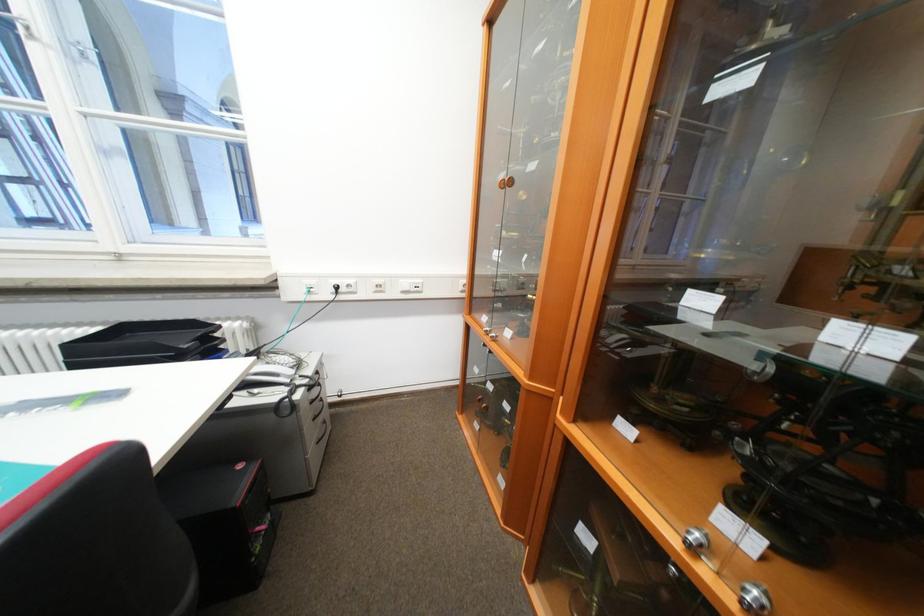
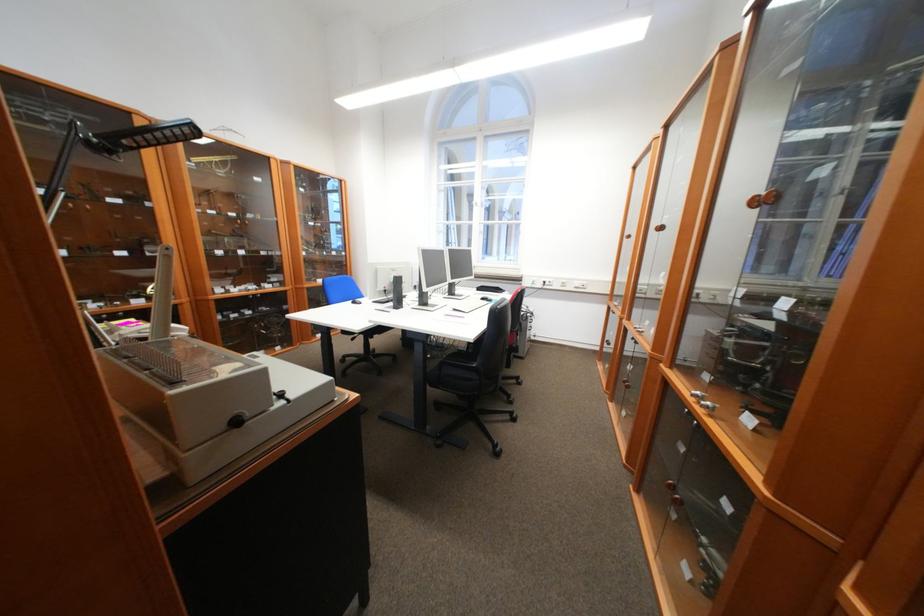
The point at (346, 400) is marked in the first image. Where is the corresponding point in the second image?

(541, 339)